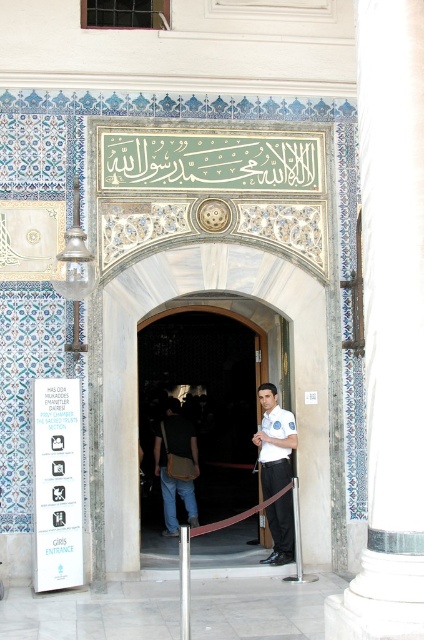
Question: Which of the following is the farthest from the observer?

Choices:
 (A) (159, 454)
 (B) (276, 474)
 (C) (219, 465)

Answer: (C)

Question: Does white marble pillar at center appear over dark brown leather jacket at center?

Choices:
 (A) no
 (B) yes

Answer: (B)

Question: Does wooden door at center come in front of white uniform at center?

Choices:
 (A) no
 (B) yes

Answer: (A)

Question: Which of the following is the closest to the observer?

Choices:
 (A) (265, 490)
 (B) (220, 404)
 (C) (167, 432)
 (D) (362, 570)

Answer: (D)

Question: Which point appears farthest from the camera in this image?

Choices:
 (A) click(379, 428)
 (B) click(181, 436)
 (C) click(214, 365)
 (D) click(259, 460)

Answer: (C)

Question: Can you confirm if white uniform at center is wider than dark brown leather jacket at center?

Choices:
 (A) yes
 (B) no

Answer: (B)